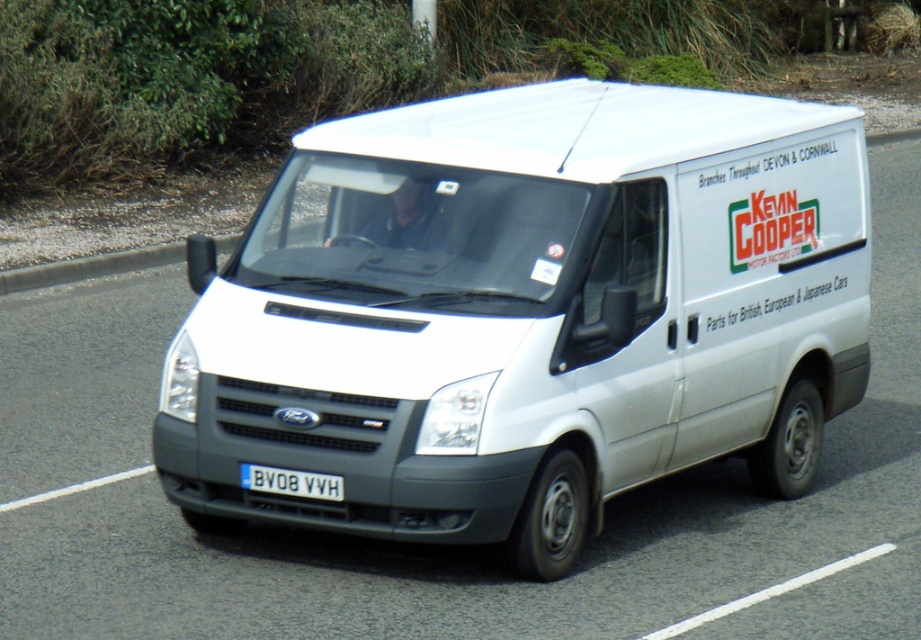
Question: Does white matte van at center have a smaller size compared to white plastic license plate at center?

Choices:
 (A) yes
 (B) no

Answer: (B)

Question: Can you confirm if white matte van at center is positioned to the right of white plastic license plate at center?

Choices:
 (A) yes
 (B) no

Answer: (A)

Question: Is white matte van at center behind white plastic license plate at center?

Choices:
 (A) yes
 (B) no

Answer: (B)

Question: Which point is closer to the camera taking this photo?

Choices:
 (A) (270, 467)
 (B) (815, 141)

Answer: (A)